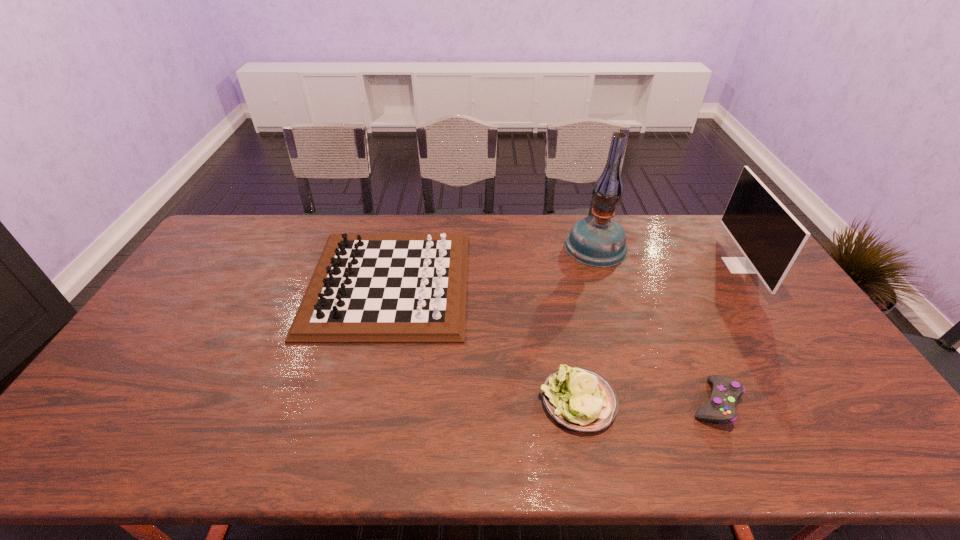
The height and width of the screenshot is (540, 960). In order to click on object that is at the far right corner in this screenshot , I will do `click(769, 236)`.

Image resolution: width=960 pixels, height=540 pixels. Find the location of `vacant space at the far edge of the desktop`. vacant space at the far edge of the desktop is located at coordinates (354, 214).

The image size is (960, 540). I want to click on vacant region at the near edge of the desktop, so click(x=429, y=442).

Image resolution: width=960 pixels, height=540 pixels. In the image, there is a desktop. What are the coordinates of `vacant space at the left edge` in the screenshot? It's located at (211, 297).

You are a GUI agent. You are given a task and a screenshot of the screen. Output one action in this format:
    pyautogui.click(x=<x>, y=<y>)
    Task: Click on the free region at the right edge
    
    Given the screenshot: What is the action you would take?
    pyautogui.click(x=785, y=293)

Identify the location of blank region between the second shortest object and the control. (646, 402).

I want to click on free space between the monitor and the leftmost object, so click(564, 274).

This screenshot has width=960, height=540. Find the location of `free area in between the third tallest object and the second tallest object`. free area in between the third tallest object and the second tallest object is located at coordinates (564, 274).

Locate an element on the screen. The height and width of the screenshot is (540, 960). free space between the rightmost object and the gameboard is located at coordinates [564, 274].

Locate an element on the screen. The width and height of the screenshot is (960, 540). free space between the fourth tallest object and the leftmost object is located at coordinates (483, 342).